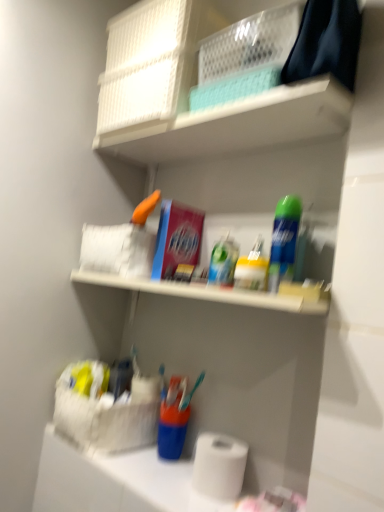
The width and height of the screenshot is (384, 512). What do you see at coordinates (223, 262) in the screenshot? I see `translucent plastic toothpaste at center, the first toiletry viewed from the left` at bounding box center [223, 262].

Image resolution: width=384 pixels, height=512 pixels. What do you see at coordinates (114, 481) in the screenshot?
I see `white matte paper towel at lower center` at bounding box center [114, 481].

I want to click on white matte toilet paper at lower center, so click(219, 465).

Describe the element at coordinates (252, 268) in the screenshot. I see `translucent plastic container at center, which is the first toiletry in right-to-left order` at that location.

Identify the location of translucent plastic toothpaste at center, the first toiletry viewed from the left. (223, 262).

Between white matte paper towel at lower center and translucent plastic container at center, which is the first toiletry in right-to-left order, which one appears on the right side from the viewer's perspective?

Positioned to the right is translucent plastic container at center, which is the first toiletry in right-to-left order.

From the image's perspective, which one is positioned higher, white matte paper towel at lower center or translucent plastic container at center, which is the first toiletry in right-to-left order?

translucent plastic container at center, which is the first toiletry in right-to-left order, is shown above in the image.

Who is more distant, white matte paper towel at lower center or translucent plastic container at center, which is the second toiletry from left to right?

translucent plastic container at center, which is the second toiletry from left to right, is further away from the camera.

How distant is white matte paper towel at lower center from translucent plastic container at center, which is the second toiletry from left to right?

white matte paper towel at lower center is 54.64 centimeters from translucent plastic container at center, which is the second toiletry from left to right.

Is white matte toilet paper at lower center inside the boundaries of translucent plastic toothpaste at center, the first toiletry viewed from the left, or outside?

white matte toilet paper at lower center is not inside translucent plastic toothpaste at center, the first toiletry viewed from the left, it's outside.

Considering the positions of point (243, 468) and point (230, 263), is point (243, 468) closer or farther from the camera than point (230, 263)?

Point (243, 468).

From the image's perspective, is white matte toilet paper at lower center above or below translucent plastic toothpaste at center, which ranks as the second toiletry in right-to-left order?

Based on their image positions, white matte toilet paper at lower center is located beneath translucent plastic toothpaste at center, which ranks as the second toiletry in right-to-left order.

Who is more distant, green matte spray can at upper right or translucent plastic toothpaste at center, the first toiletry viewed from the left?

translucent plastic toothpaste at center, the first toiletry viewed from the left, is more distant.

From the image's perspective, is green matte spray can at upper right located above translucent plastic toothpaste at center, which ranks as the second toiletry in right-to-left order?

Yes, from the image's perspective, green matte spray can at upper right is above translucent plastic toothpaste at center, which ranks as the second toiletry in right-to-left order.

I want to click on cleaning product on the right of translucent plastic toothpaste at center, which ranks as the second toiletry in right-to-left order, so click(x=284, y=241).

Looking at this image, is green matte spray can at upper right not near translucent plastic toothpaste at center, the first toiletry viewed from the left?

No, green matte spray can at upper right is not far from translucent plastic toothpaste at center, the first toiletry viewed from the left.

Is point (272, 251) positioned in front of point (168, 468)?

Yes, point (272, 251) is closer to viewer.

Is green matte spray can at upper right smaller than white matte paper towel at lower center?

Yes.

From the image's perspective, between green matte spray can at upper right and white matte paper towel at lower center, which one is located above?

green matte spray can at upper right appears higher in the image.

Considering the positions of points (114, 478) and (220, 281), is point (114, 478) farther from camera compared to point (220, 281)?

No, (114, 478) is in front of (220, 281).

Is white matte paper towel at lower center touching translucent plastic toothpaste at center, which ranks as the second toiletry in right-to-left order?

No.

From a real-world perspective, is white matte paper towel at lower center on top of translucent plastic toothpaste at center, the first toiletry viewed from the left?

No.

From their relative heights in the image, would you say white matte paper towel at lower center is taller or shorter than white matte toilet paper at lower center?

white matte paper towel at lower center is shorter than white matte toilet paper at lower center.

Considering the points (192, 490) and (208, 472), which point is behind, point (192, 490) or point (208, 472)?

The point (192, 490) is farther from the camera.

Is white matte paper towel at lower center not inside white matte toilet paper at lower center?

Yes, white matte paper towel at lower center is not within white matte toilet paper at lower center.

Could you tell me if white matte paper towel at lower center is turned towards white matte toilet paper at lower center?

No, white matte paper towel at lower center is not aimed at white matte toilet paper at lower center.

Considering the positions of objects white matte toilet paper at lower center and white matte paper towel at lower center in the image provided, who is in front, white matte toilet paper at lower center or white matte paper towel at lower center?

white matte paper towel at lower center is in front.

What's the angular difference between white matte toilet paper at lower center and white matte paper towel at lower center's facing directions?

The angle between the facing direction of white matte toilet paper at lower center and the facing direction of white matte paper towel at lower center is 0.000126 degrees.

In terms of height, does white matte toilet paper at lower center look taller or shorter compared to white matte paper towel at lower center?

white matte toilet paper at lower center is taller than white matte paper towel at lower center.

Is white matte toilet paper at lower center positioned with its back to white matte paper towel at lower center?

That's not correct — white matte toilet paper at lower center is not looking away from white matte paper towel at lower center.

This screenshot has height=512, width=384. In order to click on the 1st toiletry located above the white matte paper towel at lower center (from a real-world perspective) in this screenshot , I will do `click(252, 268)`.

From the image's perspective, starting from the white matte toilet paper at lower center, which toiletry is the 2nd one above? Please provide its 2D coordinates.

[(223, 262)]

Estimate the real-world distances between objects in this image. Which object is further from green matte spray can at upper right, white mesh basket at upper center or translucent plastic container at center, which is the second toiletry from left to right?

white mesh basket at upper center is further to green matte spray can at upper right.

From the image, which object appears to be farther from white matte paper towel at lower center, translucent plastic toothpaste at center, the first toiletry viewed from the left, or white matte toilet paper at lower center?

Among the two, translucent plastic toothpaste at center, the first toiletry viewed from the left, is located further to white matte paper towel at lower center.

Considering their positions, is white matte paper towel at lower center positioned closer to green matte spray can at upper right than white matte toilet paper at lower center?

white matte toilet paper at lower center.

Which object lies nearer to the anchor point translucent plastic toothpaste at center, the first toiletry viewed from the left, white mesh basket at upper center or green matte spray can at upper right?

Based on the image, green matte spray can at upper right appears to be nearer to translucent plastic toothpaste at center, the first toiletry viewed from the left.

When comparing their distances from white matte toilet paper at lower center, does translucent plastic toothpaste at center, the first toiletry viewed from the left, or white matte paper towel at lower center seem closer?

white matte paper towel at lower center is positioned closer to the anchor white matte toilet paper at lower center.

Estimate the real-world distances between objects in this image. Which object is further from green matte spray can at upper right, translucent plastic container at center, which is the first toiletry in right-to-left order, or white matte paper towel at lower center?

white matte paper towel at lower center lies further to green matte spray can at upper right than the other object.

Which object lies further to the anchor point translucent plastic toothpaste at center, which ranks as the second toiletry in right-to-left order, white matte toilet paper at lower center or green matte spray can at upper right?

white matte toilet paper at lower center lies further to translucent plastic toothpaste at center, which ranks as the second toiletry in right-to-left order, than the other object.

Looking at the image, which one is located closer to white mesh basket at upper center, translucent plastic container at center, which is the first toiletry in right-to-left order, or translucent plastic toothpaste at center, which ranks as the second toiletry in right-to-left order?

translucent plastic toothpaste at center, which ranks as the second toiletry in right-to-left order, is positioned closer to the anchor white mesh basket at upper center.

This screenshot has width=384, height=512. Find the location of `toilet paper between white mesh basket at upper center and white matte paper towel at lower center vertically`. toilet paper between white mesh basket at upper center and white matte paper towel at lower center vertically is located at coordinates (219, 465).

Locate an element on the screen. Image resolution: width=384 pixels, height=512 pixels. toiletry positioned between green matte spray can at upper right and translucent plastic toothpaste at center, which ranks as the second toiletry in right-to-left order, from near to far is located at coordinates (252, 268).

You are a GUI agent. You are given a task and a screenshot of the screen. Output one action in this format:
    pyautogui.click(x=<x>, y=<y>)
    Task: Click on the cleaning product that lies between white mesh basket at upper center and translucent plastic container at center, which is the first toiletry in right-to-left order, from top to bottom
    This screenshot has width=384, height=512.
    Given the screenshot: What is the action you would take?
    pyautogui.click(x=284, y=241)

Locate an element on the screen. This screenshot has width=384, height=512. toiletry between translucent plastic toothpaste at center, the first toiletry viewed from the left, and white matte toilet paper at lower center, in the vertical direction is located at coordinates (252, 268).